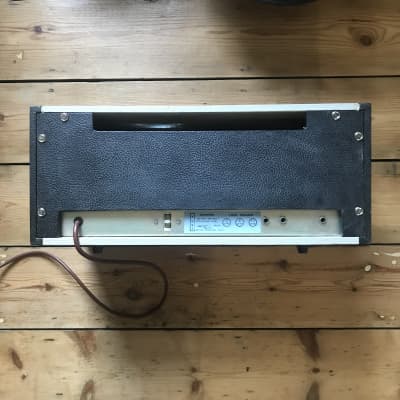
Locate an element on the screen. The height and width of the screenshot is (400, 400). on off switch is located at coordinates (167, 222).